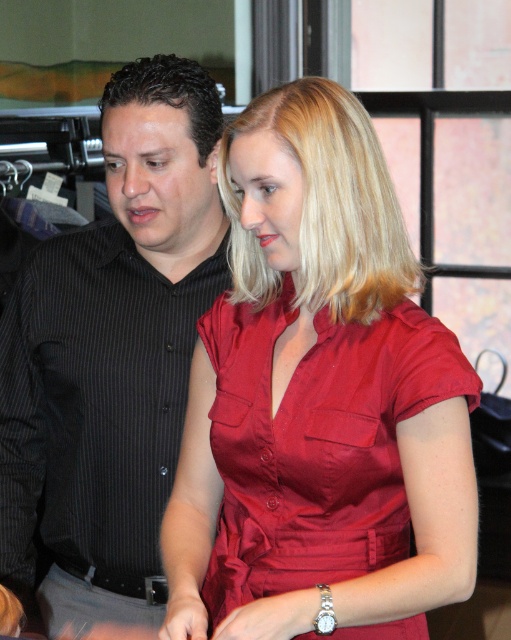
You are standing in the room and want to hand a document to the person wearing the black striped shirt at center. Based on their position, which direction should you move to reach them?

The black striped shirt at center is located at point (112, 355), so you should move towards the coordinates to reach them.

You are a tailor measuring clothing for two customers. The first customer is wearing a black striped shirt at center and the second is wearing a shiny red blouse at center. Which clothing item has a narrower width?

The black striped shirt at center has a lesser width compared to the shiny red blouse at center, so the black striped shirt at center is narrower.